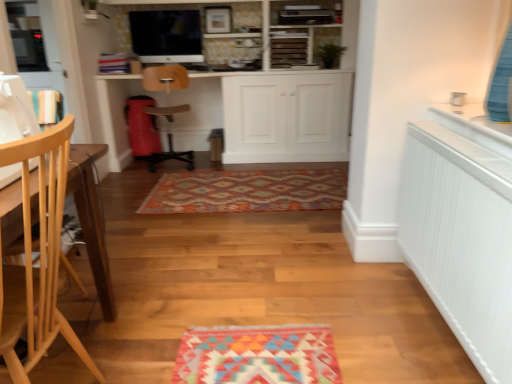
This screenshot has height=384, width=512. What do you see at coordinates (15, 110) in the screenshot?
I see `wooden sewing machine at left` at bounding box center [15, 110].

What is the approximate height of wooden at center, the 2th chair from the front?

35.36 inches.

In order to face wooden at center, the second chair in the bottom-to-top sequence, should I rotate leftwards or rightwards?

Turn left approximately 11.594 degrees to face it.

At what (x,y) coordinates should I click in order to perform the action: click on white matte cabinet at center. Please return your answer as a coordinate pair (x, y). The image size is (512, 384). Looking at the image, I should click on (244, 115).

What do you see at coordinates (166, 36) in the screenshot? The height and width of the screenshot is (384, 512). I see `satin black monitor at upper center` at bounding box center [166, 36].

Find the location of `wooden sewing machine at left`. wooden sewing machine at left is located at coordinates (15, 110).

Which object is wider, light wood chair at left, arranged as the second chair when viewed from the back, or wooden at center, the 2th chair from the front?

Wider between the two is wooden at center, the 2th chair from the front.

Is light wood chair at left, arranged as the 1th chair when ordered from the bottom, oriented towards wooden at center, placed as the 1th chair when sorted from back to front?

No, light wood chair at left, arranged as the 1th chair when ordered from the bottom, is not aimed at wooden at center, placed as the 1th chair when sorted from back to front.

From a real-world perspective, is light wood chair at left, which appears as the second chair when viewed from the top, under wooden at center, placed as the 1th chair when sorted from back to front?

No.

At what (x,y) coordinates should I click in order to perform the action: click on chair that is above the wooden at center, which is the first chair from top to bottom (from a real-world perspective). Please return your answer as a coordinate pair (x, y). The width and height of the screenshot is (512, 384). Looking at the image, I should click on (40, 256).

Is white matte cabinet at center positioned beyond the bounds of satin black monitor at upper center?

Indeed, white matte cabinet at center is completely outside satin black monitor at upper center.

Between white matte cabinet at center and satin black monitor at upper center, which one has smaller width?

Thinner between the two is satin black monitor at upper center.

From the picture: Does white matte cabinet at center turn towards satin black monitor at upper center?

No, white matte cabinet at center is not facing towards satin black monitor at upper center.

Looking at this image, considering the relative positions of wooden at center, the 2th chair from the front, and white matte cabinet at center in the image provided, is wooden at center, the 2th chair from the front, to the right of white matte cabinet at center from the viewer's perspective?

No, wooden at center, the 2th chair from the front, is not to the right of white matte cabinet at center.

Is point (170, 68) closer or farther from the camera than point (222, 125)?

Point (170, 68).

Who is smaller, wooden at center, which is the first chair from top to bottom, or white matte cabinet at center?

wooden at center, which is the first chair from top to bottom.

Which object is positioned more to the right, white matte cabinet at center or wooden sewing machine at left?

From the viewer's perspective, white matte cabinet at center appears more on the right side.

From a real-world perspective, is white matte cabinet at center positioned above or below wooden sewing machine at left?

white matte cabinet at center is situated lower than wooden sewing machine at left in the real world.

Does white matte cabinet at center have a greater width compared to wooden sewing machine at left?

Correct, the width of white matte cabinet at center exceeds that of wooden sewing machine at left.

What's the angular difference between white matte cabinet at center and wooden sewing machine at left's facing directions?

The angle between the facing direction of white matte cabinet at center and the facing direction of wooden sewing machine at left is 91.3 degrees.

Considering the sizes of objects wooden sewing machine at left and wooden at center, placed as the 1th chair when sorted from back to front, in the image provided, who is bigger, wooden sewing machine at left or wooden at center, placed as the 1th chair when sorted from back to front,?

With larger size is wooden at center, placed as the 1th chair when sorted from back to front.

Considering the positions of points (3, 179) and (160, 84), is point (3, 179) closer to camera compared to point (160, 84)?

Yes, it is in front of point (160, 84).

Consider the image. Considering the relative positions of wooden sewing machine at left and wooden at center, which is the first chair from top to bottom, in the image provided, is wooden sewing machine at left behind wooden at center, which is the first chair from top to bottom,?

That is False.

Where is `chair lying behind the wooden sewing machine at left`? The width and height of the screenshot is (512, 384). chair lying behind the wooden sewing machine at left is located at coordinates (165, 78).

Who is bigger, wooden sewing machine at left or white matte cabinet at center?

With larger size is white matte cabinet at center.

This screenshot has width=512, height=384. I want to click on cabinetry lying above the wooden sewing machine at left (from the image's perspective), so click(x=244, y=115).

Looking at this image, is wooden sewing machine at left not within white matte cabinet at center?

Yes, wooden sewing machine at left is located beyond the bounds of white matte cabinet at center.

Is the depth of wooden sewing machine at left greater than that of white matte cabinet at center?

No, it is in front of white matte cabinet at center.

Is wooden sewing machine at left surrounding light wood chair at left, arranged as the second chair when viewed from the back?

No, light wood chair at left, arranged as the second chair when viewed from the back, is not inside wooden sewing machine at left.

Relative to light wood chair at left, arranged as the 1th chair when ordered from the bottom, is wooden sewing machine at left in front or behind?

Clearly, wooden sewing machine at left is behind light wood chair at left, arranged as the 1th chair when ordered from the bottom.

In terms of size, does wooden sewing machine at left appear bigger or smaller than light wood chair at left, arranged as the second chair when viewed from the back?

Clearly, wooden sewing machine at left is smaller in size than light wood chair at left, arranged as the second chair when viewed from the back.

Is wooden sewing machine at left with light wood chair at left, which appears as the second chair when viewed from the top?

There is a gap between wooden sewing machine at left and light wood chair at left, which appears as the second chair when viewed from the top.

The image size is (512, 384). Find the location of `chair above the light wood chair at left, which appears as the 1th chair when viewed from the front (from the image's perspective)`. chair above the light wood chair at left, which appears as the 1th chair when viewed from the front (from the image's perspective) is located at coordinates (165, 78).

At what (x,y) coordinates should I click in order to perform the action: click on cabinetry lying on the right of satin black monitor at upper center. Please return your answer as a coordinate pair (x, y). The height and width of the screenshot is (384, 512). Looking at the image, I should click on (244, 115).

Based on their spatial positions, is wooden sewing machine at left or wooden at center, placed as the 1th chair when sorted from back to front, further from white matte cabinet at center?

wooden sewing machine at left is further to white matte cabinet at center.

From the picture: Considering their positions, is wooden at center, the 2th chair from the front, positioned further to white matte cabinet at center than satin black monitor at upper center?

wooden at center, the 2th chair from the front.

Looking at the image, which one is located closer to white matte cabinet at center, satin black monitor at upper center or wooden sewing machine at left?

satin black monitor at upper center is closer to white matte cabinet at center.

From the image, which object appears to be farther from white matte cabinet at center, white textured radiator at right or light wood chair at left, which appears as the 1th chair when viewed from the front?

light wood chair at left, which appears as the 1th chair when viewed from the front, is further to white matte cabinet at center.

Based on their spatial positions, is wooden sewing machine at left or wooden at center, the 2th chair from the front, further from light wood chair at left, which appears as the 1th chair when viewed from the front?

wooden at center, the 2th chair from the front, is positioned further to the anchor light wood chair at left, which appears as the 1th chair when viewed from the front.

Estimate the real-world distances between objects in this image. Which object is further from wooden sewing machine at left, light wood chair at left, which appears as the 1th chair when viewed from the front, or white textured radiator at right?

white textured radiator at right is positioned further to the anchor wooden sewing machine at left.

Estimate the real-world distances between objects in this image. Which object is further from wooden sewing machine at left, wooden at center, which is the first chair from top to bottom, or satin black monitor at upper center?

satin black monitor at upper center is positioned further to the anchor wooden sewing machine at left.

Considering their positions, is wooden at center, which is the first chair from top to bottom, positioned further to white textured radiator at right than wooden sewing machine at left?

Among the two, wooden at center, which is the first chair from top to bottom, is located further to white textured radiator at right.

Image resolution: width=512 pixels, height=384 pixels. In order to click on radiator located between light wood chair at left, which appears as the second chair when viewed from the top, and wooden at center, the 2th chair from the front, in the depth direction in this screenshot , I will do `click(461, 239)`.

This screenshot has height=384, width=512. What are the coordinates of `sewing machine between white textured radiator at right and satin black monitor at upper center along the z-axis` in the screenshot? It's located at (15, 110).

The width and height of the screenshot is (512, 384). I want to click on sewing machine between white textured radiator at right and white matte cabinet at center along the z-axis, so click(15, 110).

Where is `cabinetry between wooden sewing machine at left and satin black monitor at upper center from front to back`? cabinetry between wooden sewing machine at left and satin black monitor at upper center from front to back is located at coordinates (244, 115).